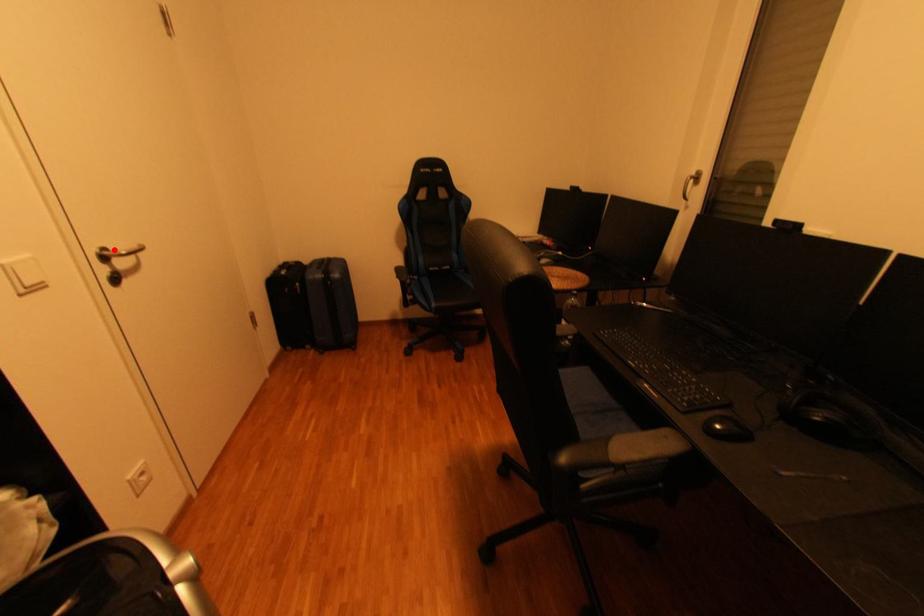
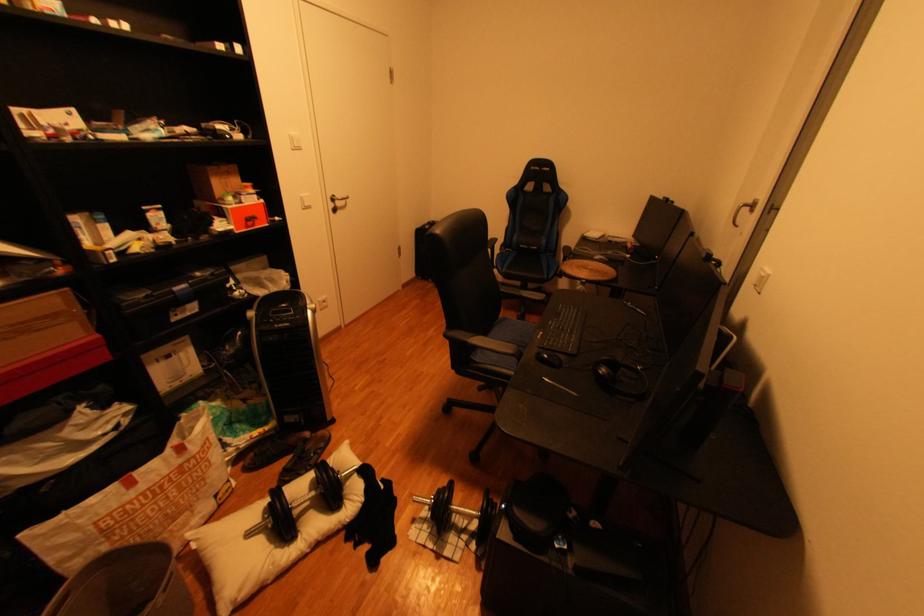
The point at the highlighted location is marked in the first image. Where is the corresponding point in the second image?

(345, 197)